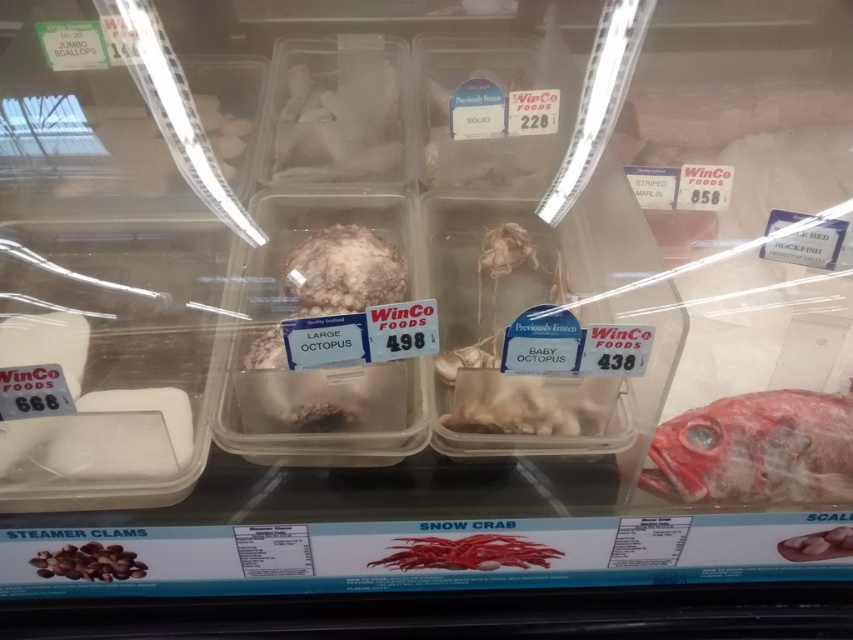
Question: Does shiny red fish at lower right appear on the right side of white matte scallops at lower right?

Choices:
 (A) yes
 (B) no

Answer: (B)

Question: Does white matte octopus at center have a lesser width compared to brown matte clams at lower left?

Choices:
 (A) yes
 (B) no

Answer: (B)

Question: Which of the following is the farthest from the observer?

Choices:
 (A) tap(540, 556)
 (B) tap(316, 259)
 (C) tap(126, 560)
 (D) tap(341, 88)

Answer: (D)

Question: Is white frosted octopus at center further to the viewer compared to brown matte clams at lower left?

Choices:
 (A) yes
 (B) no

Answer: (A)

Question: Which point appears closest to the camera in this image?

Choices:
 (A) (140, 566)
 (B) (799, 403)

Answer: (A)

Question: Which of the following is the closest to the observer?

Choices:
 (A) bright red snow crab at center
 (B) brown matte clams at lower left

Answer: (B)